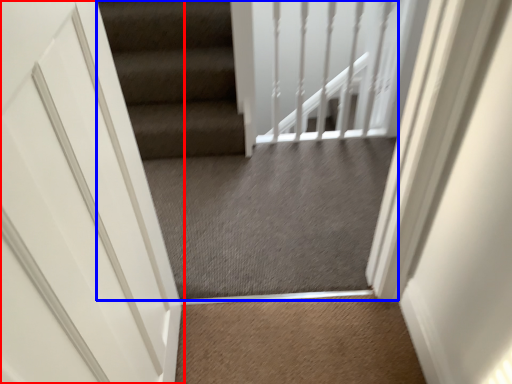
Question: Among these objects, which one is nearest to the camera, door (highlighted by a red box) or escalator (highlighted by a blue box)?

Choices:
 (A) door
 (B) escalator

Answer: (A)